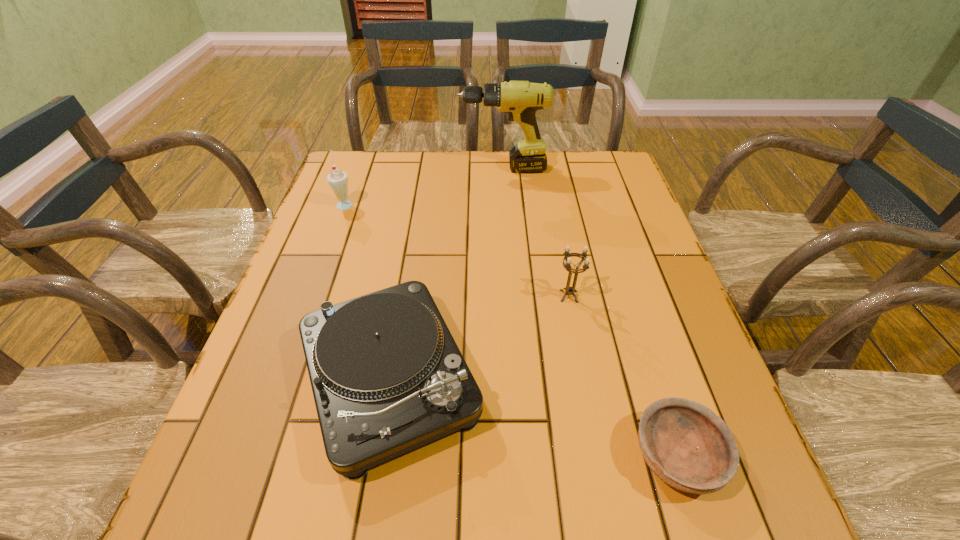
Where is `the tallest object`? Image resolution: width=960 pixels, height=540 pixels. the tallest object is located at coordinates (520, 99).

Identify the location of the farthest object. This screenshot has height=540, width=960. (520, 99).

Find the location of a particular element. the leftmost object is located at coordinates (338, 180).

This screenshot has width=960, height=540. I want to click on milkshake, so click(338, 180).

Identify the location of candle holder. (569, 290).

The width and height of the screenshot is (960, 540). I want to click on record player, so click(x=387, y=376).

At what (x,y) coordinates should I click in order to perform the action: click on the shortest object. Please return your answer as a coordinate pair (x, y). The image size is (960, 540). Looking at the image, I should click on (684, 443).

At what (x,y) coordinates should I click in order to perform the action: click on bowl. Please return your answer as a coordinate pair (x, y). Looking at the image, I should click on (684, 443).

Identify the location of free spot located on the handle side of the farthest object. The width and height of the screenshot is (960, 540). (363, 168).

I want to click on free space located on the handle side of the farthest object, so click(x=400, y=168).